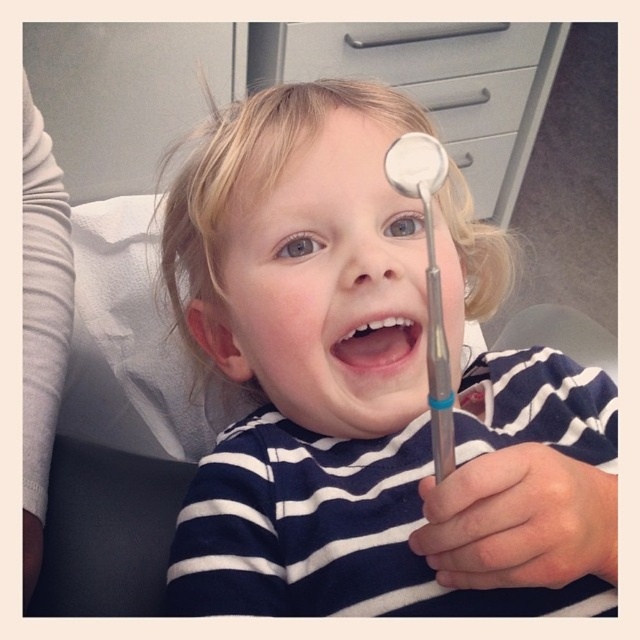
Based on the photo, what is the exact coordinate of the matte silver dental mirror at center?

The matte silver dental mirror at center is located at point (349, 372).

You are a dentist examining a child patient. You notice the metallic silver mirror at upper center and the pink glossy lips at center. Where is the metallic silver mirror in relation to the pink glossy lips?

The metallic silver mirror at upper center is located above the pink glossy lips at center.

The child is holding a metallic silver mirror at upper center and has pink glossy lips at center. Which object is wider?

The pink glossy lips at center are wider than the metallic silver mirror at upper center.